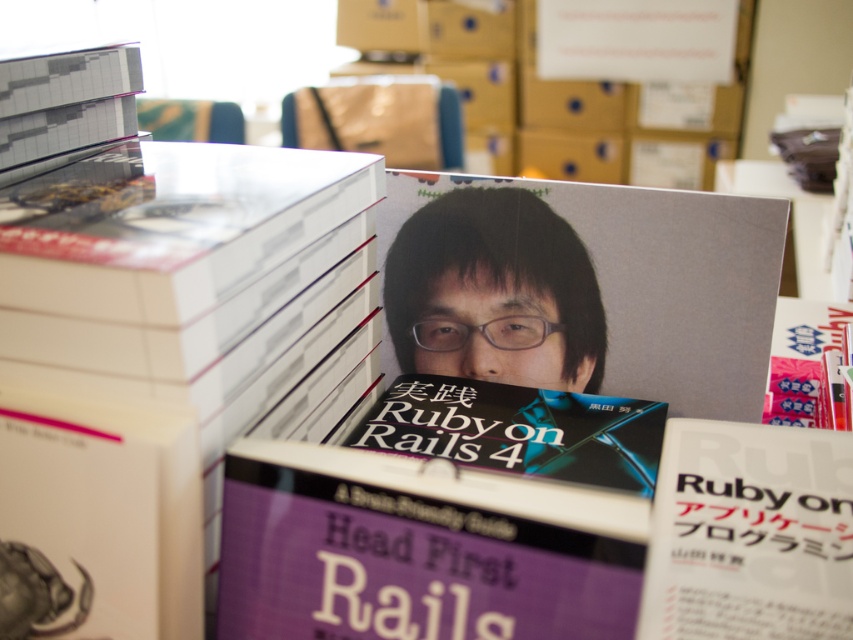
Question: Which of the following is the closest to the observer?

Choices:
 (A) black matte book at center
 (B) matte black book at center

Answer: (A)

Question: Estimate the real-world distances between objects in this image. Which object is farther from the matte black book at center?

Choices:
 (A) black matte book at center
 (B) gray matte book at upper right
 (C) white paper book at center

Answer: (B)

Question: Considering the relative positions of matte black book at center and black matte book at center in the image provided, where is matte black book at center located with respect to black matte book at center?

Choices:
 (A) below
 (B) above

Answer: (B)

Question: Among these objects, which one is farthest from the camera?

Choices:
 (A) white paper book at center
 (B) black matte book at center

Answer: (B)

Question: Does white paper book at center appear on the right side of matte black book at center?

Choices:
 (A) yes
 (B) no

Answer: (A)

Question: From the image, what is the correct spatial relationship of white paper book at center in relation to black matte book at center?

Choices:
 (A) above
 (B) below

Answer: (B)